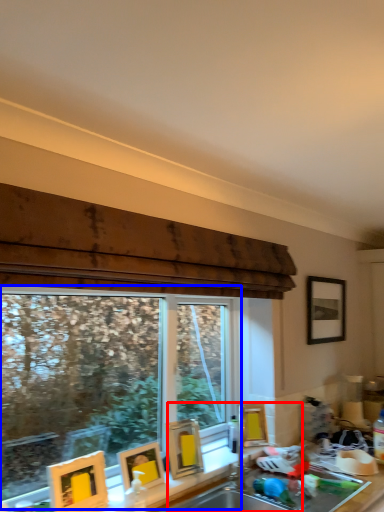
Question: Which object appears farthest to the camera in this image, sink (highlighted by a red box) or window (highlighted by a blue box)?

Choices:
 (A) sink
 (B) window

Answer: (A)